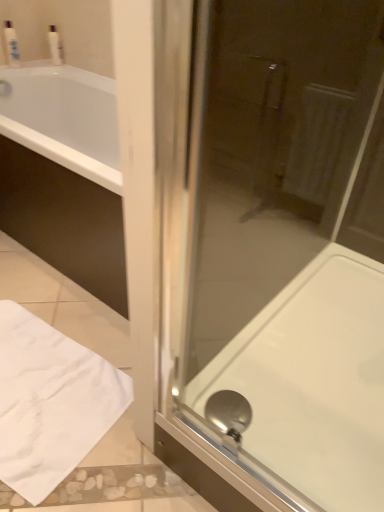
This screenshot has height=512, width=384. Identify the location of empty space that is ontop of white fabric towel at lower left (from a real-world perspective). (37, 380).